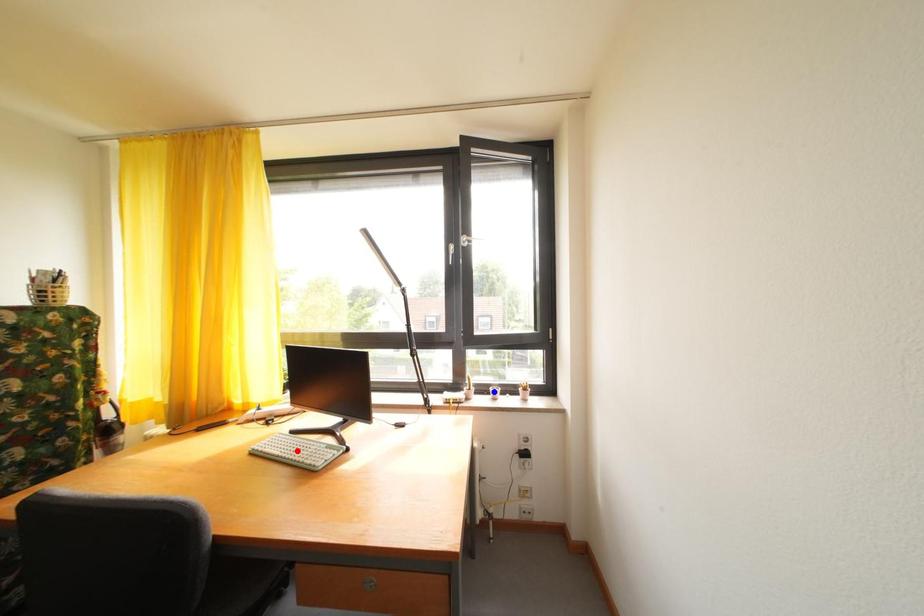
Question: In the image, two points are highlighted. Which point is nearer to the camera? Reply with the corresponding letter.

Choices:
 (A) blue point
 (B) red point

Answer: (B)